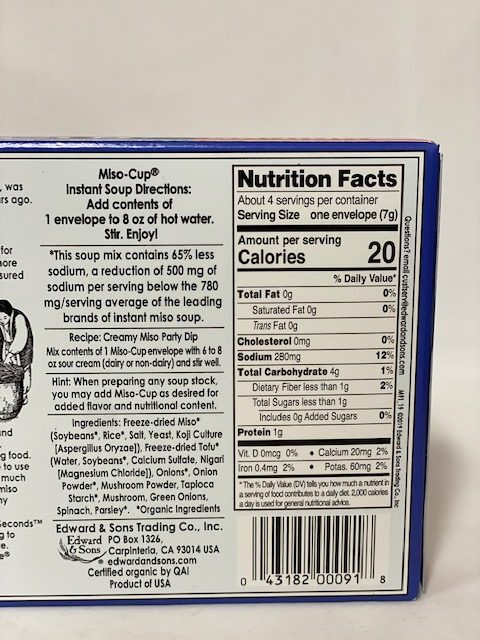
This screenshot has width=480, height=640. What are the coordinates of `box` in the screenshot? It's located at (397, 534).